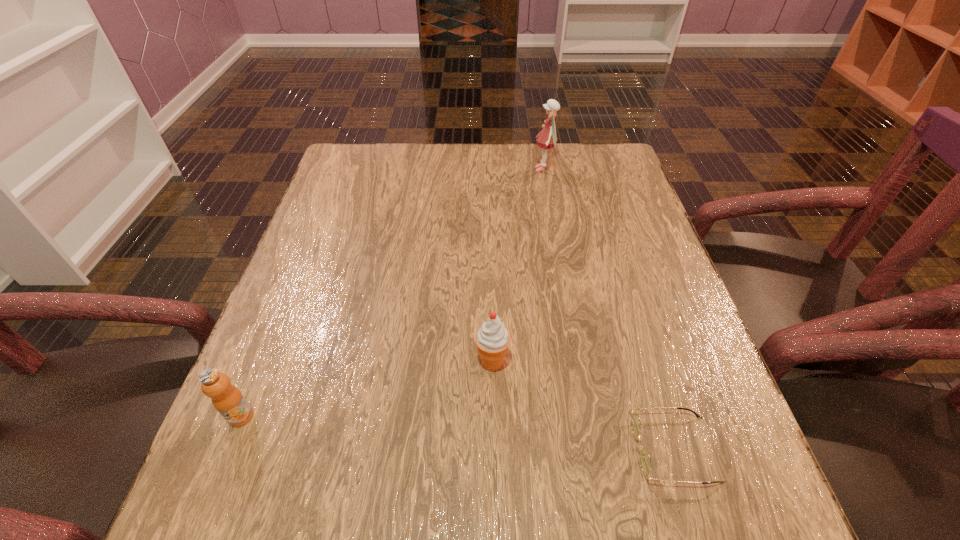
Identify the location of the tallest object. This screenshot has width=960, height=540. (547, 138).

At what (x,y) coordinates should I click in order to perform the action: click on the third object from left to right. Please return your answer as a coordinate pair (x, y). The height and width of the screenshot is (540, 960). Looking at the image, I should click on tap(547, 138).

Where is `the third object from right to left`? This screenshot has height=540, width=960. the third object from right to left is located at coordinates (492, 339).

I want to click on icecream, so click(x=492, y=339).

You are a GUI agent. You are given a task and a screenshot of the screen. Output one action in this format:
    pyautogui.click(x=<x>, y=<y>)
    Task: Click on the leftmost object
    
    Given the screenshot: What is the action you would take?
    pyautogui.click(x=227, y=399)

Find the location of `spectacles`. spectacles is located at coordinates (645, 461).

Find the location of a particular element. The height and width of the screenshot is (540, 960). the shortest object is located at coordinates (645, 461).

Where is `blank area located 0.140m on the front-facing side of the doll`? This screenshot has width=960, height=540. blank area located 0.140m on the front-facing side of the doll is located at coordinates (484, 170).

Find the location of a particular element. The image size is (960, 540). free spot located 0.090m on the front-facing side of the doll is located at coordinates (501, 170).

I want to click on vacant area situated on the front-facing side of the doll, so [x=413, y=170].